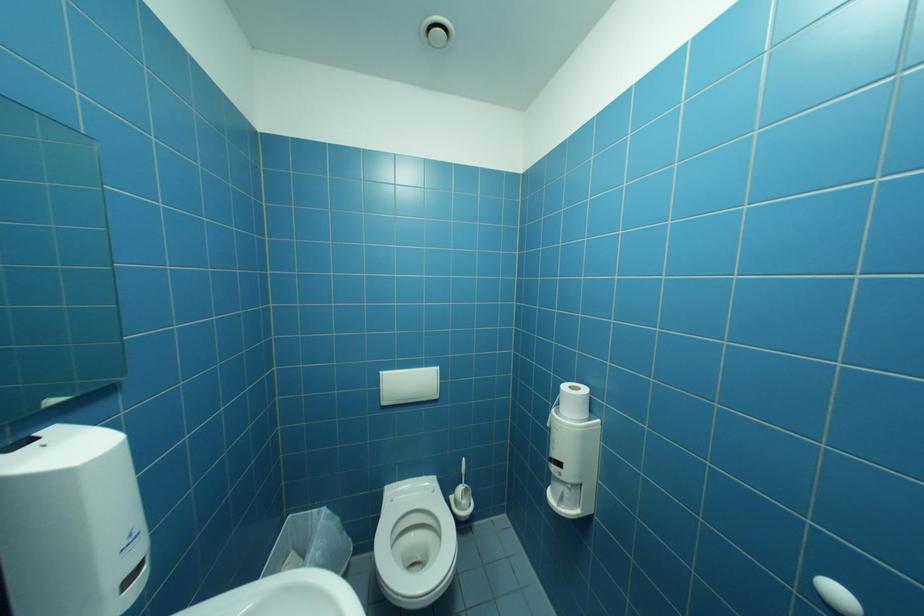
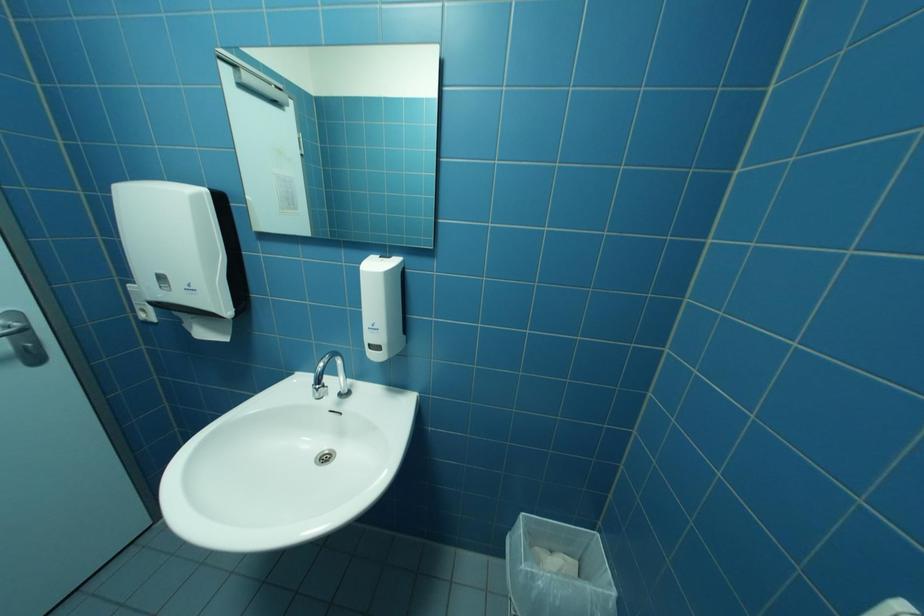
How did the camera likely rotate?

The rotation direction of the camera is left-down.